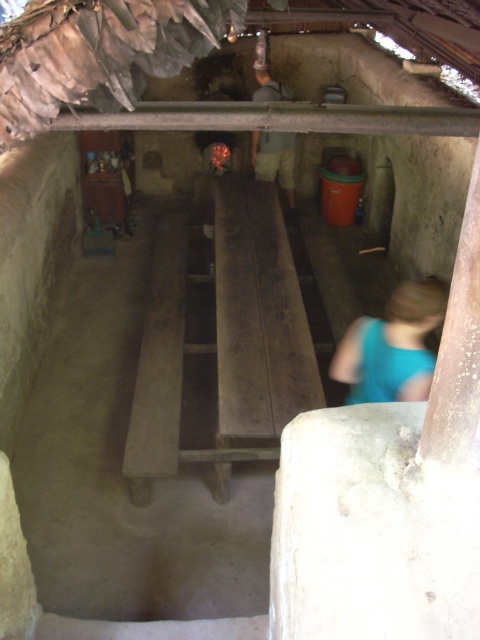
Is smooth wooden beam at upper center below light brown shorts at center?

Indeed, smooth wooden beam at upper center is positioned under light brown shorts at center.

Does point (96, 113) lie in front of point (292, 141)?

Yes, point (96, 113) is in front of point (292, 141).

Does point (126, 113) come behind point (264, 170)?

No, (126, 113) is in front of (264, 170).

At what (x,y) coordinates should I click in order to perform the action: click on smooth wooden beam at upper center. Please return your answer as a coordinate pair (x, y). This screenshot has width=480, height=640. Looking at the image, I should click on 278,118.

Can you confirm if blue fabric at lower right is thinner than light brown shorts at center?

Correct, blue fabric at lower right's width is less than light brown shorts at center's.

What do you see at coordinates (393, 346) in the screenshot?
I see `blue fabric at lower right` at bounding box center [393, 346].

Between point (343, 355) and point (278, 136), which one is positioned in front?

Point (343, 355)

The image size is (480, 640). I want to click on blue fabric at lower right, so click(393, 346).

Is smooth wooden beam at upper center positioned behind blue fabric at lower right?

That is True.

Does smooth wooden beam at upper center appear on the right side of blue fabric at lower right?

In fact, smooth wooden beam at upper center is to the left of blue fabric at lower right.

This screenshot has height=640, width=480. What do you see at coordinates (278, 118) in the screenshot? I see `smooth wooden beam at upper center` at bounding box center [278, 118].

This screenshot has height=640, width=480. What are the coordinates of `smooth wooden beam at upper center` in the screenshot? It's located at (278, 118).